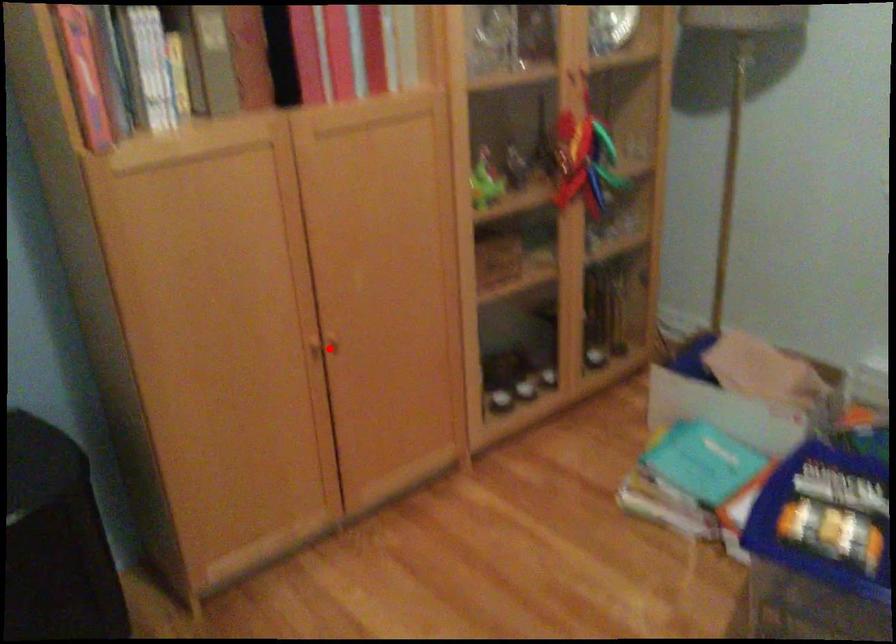
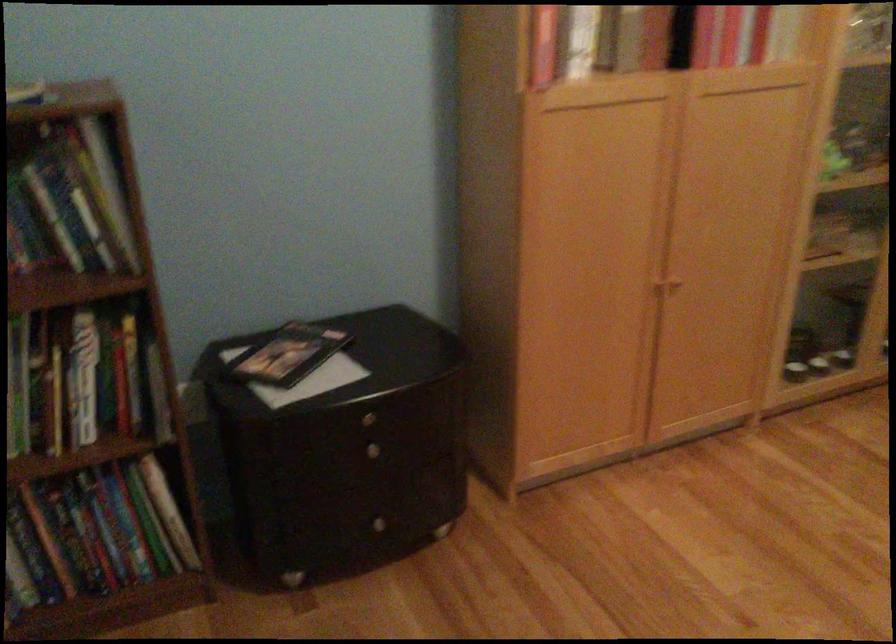
The point at the highlighted location is marked in the first image. Where is the corresponding point in the second image?

(666, 289)